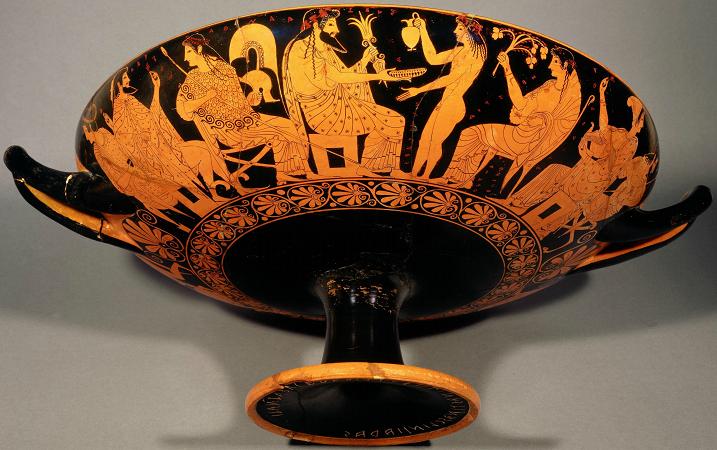
At what (x,y) coordinates should I click in order to perform the action: click on handles. Please return your answer as a coordinate pair (x, y). This screenshot has width=717, height=450. Looking at the image, I should click on (11, 159), (690, 210).